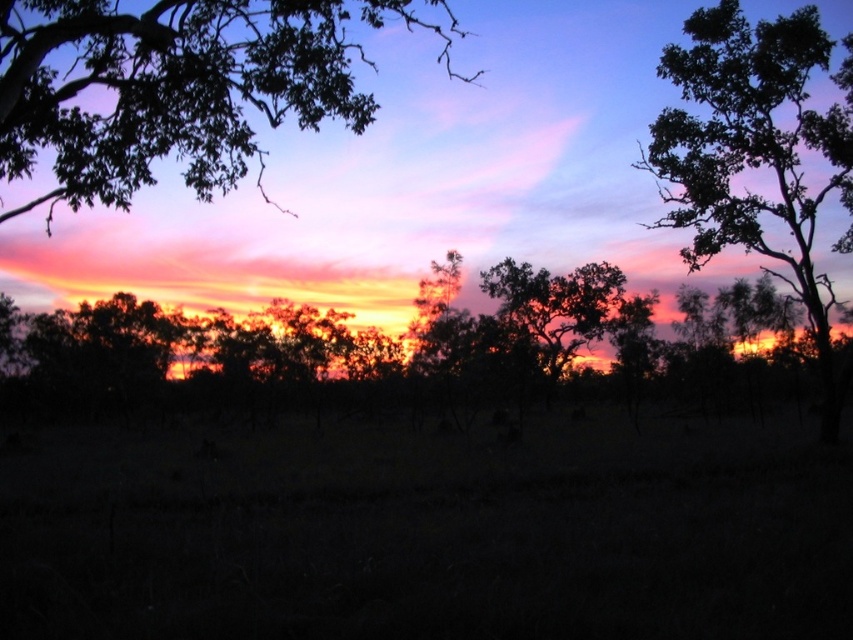
How far apart are dark green leafy tree at upper left and silhouette leafy tree at center?

dark green leafy tree at upper left is 24.63 meters away from silhouette leafy tree at center.

This screenshot has height=640, width=853. What do you see at coordinates (177, 86) in the screenshot?
I see `dark green leafy tree at upper left` at bounding box center [177, 86].

Is point (33, 154) closer to camera compared to point (618, 276)?

That is True.

The image size is (853, 640). I want to click on dark green leafy tree at upper left, so click(x=177, y=86).

Who is more forward, (x=439, y=317) or (x=281, y=29)?

Point (x=281, y=29) is in front.

Looking at this image, between silhouette tree at center and dark green leafy tree at upper left, which one has more height?

dark green leafy tree at upper left

Find the location of a particular element. The image size is (853, 640). silhouette tree at center is located at coordinates (364, 348).

Where is `silhouette tree at center`? Image resolution: width=853 pixels, height=640 pixels. silhouette tree at center is located at coordinates (364, 348).

Does dark green leafy tree at upper right appear on the left side of silhouette leafy tree at center?

No, dark green leafy tree at upper right is not to the left of silhouette leafy tree at center.

How far apart are dark green leafy tree at upper right and silhouette leafy tree at center?

dark green leafy tree at upper right is 49.70 feet from silhouette leafy tree at center.

This screenshot has height=640, width=853. Describe the element at coordinates (749, 145) in the screenshot. I see `dark green leafy tree at upper right` at that location.

Find the location of a particular element. The width and height of the screenshot is (853, 640). dark green leafy tree at upper right is located at coordinates (749, 145).